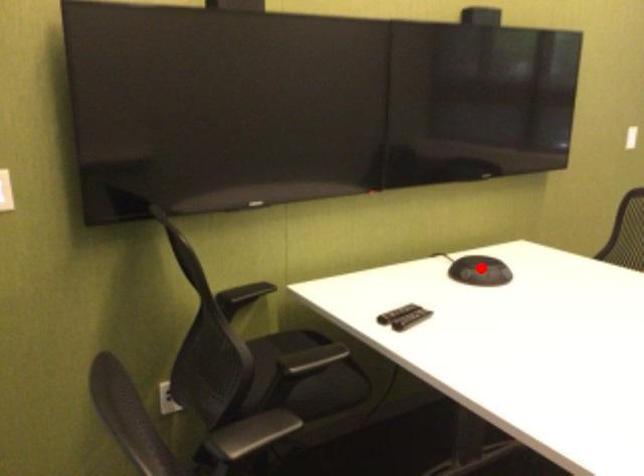
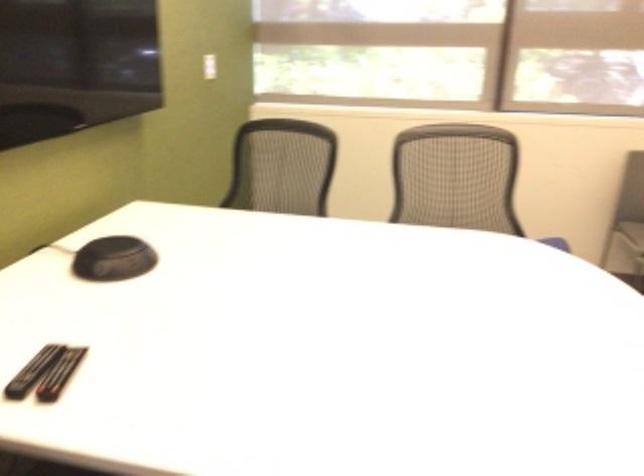
Where in the second image is the point corresponding to the highlighted location from the first image?

(113, 259)